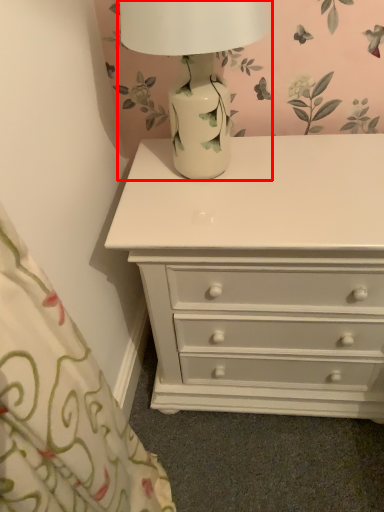
Question: Where is table lamp (annotated by the red box) located in relation to chest of drawers in the image?

Choices:
 (A) left
 (B) right

Answer: (A)